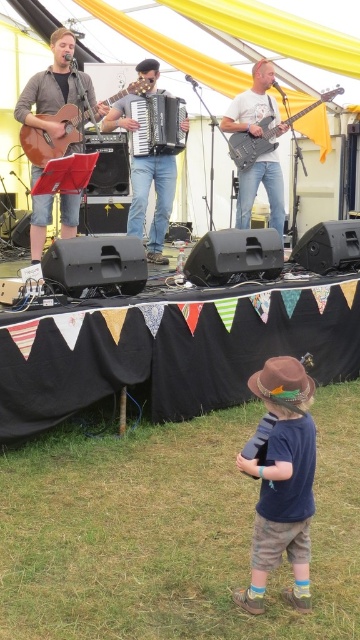
You are a photographer at the back of the audience. You want to take a photo of the brown felt cowboy hat at lower center and the matte brown acoustic guitar at left. Which object should you focus on first if you want to capture both in the same frame without moving your camera?

The matte brown acoustic guitar at left is positioned on the left side of brown felt cowboy hat at lower center, so you should focus on the matte brown acoustic guitar at left first to ensure both are in the frame.